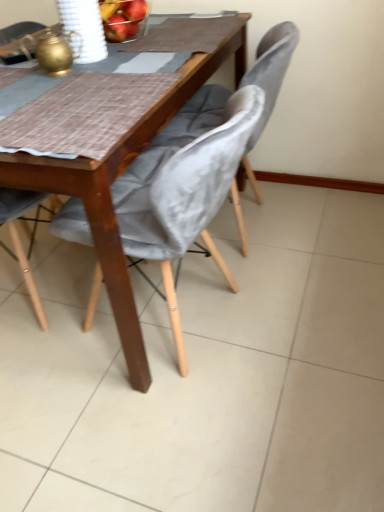
You are a GUI agent. You are given a task and a screenshot of the screen. Output one action in this format:
    pyautogui.click(x=<x>, y=<y>)
    Task: Click on the velvet grey chair at center, which is the second chair in right-to-left order
    The image size is (384, 512).
    Given the screenshot: What is the action you would take?
    pyautogui.click(x=184, y=191)

Locate an element on the screen. This screenshot has height=512, width=384. velvet grey chair at center, the third chair from the left is located at coordinates (269, 79).

Is velvet grey chair at center, the 1th chair in the right-to-left sequence, spatially inside velvet grey chair at lower left, the 3th chair positioned from the right, or outside of it?

velvet grey chair at center, the 1th chair in the right-to-left sequence, cannot be found inside velvet grey chair at lower left, the 3th chair positioned from the right.

Is the depth of velvet grey chair at center, the third chair from the left, greater than that of velvet grey chair at lower left, the 3th chair positioned from the right?

Yes, it is behind velvet grey chair at lower left, the 3th chair positioned from the right.

In terms of height, does velvet grey chair at center, the 1th chair in the right-to-left sequence, look taller or shorter compared to velvet grey chair at lower left, which is the 1th chair from left to right?

Clearly, velvet grey chair at center, the 1th chair in the right-to-left sequence, is shorter compared to velvet grey chair at lower left, which is the 1th chair from left to right.

Looking at their sizes, would you say velvet grey chair at center, which is the second chair in right-to-left order, is wider or thinner than velvet grey chair at lower left, the 3th chair positioned from the right?

velvet grey chair at center, which is the second chair in right-to-left order, is wider than velvet grey chair at lower left, the 3th chair positioned from the right.

From the image's perspective, is velvet grey chair at center, which is the second chair in right-to-left order, located above velvet grey chair at lower left, the 3th chair positioned from the right?

No.

From a real-world perspective, starting from the velvet grey chair at lower left, which is the 1th chair from left to right, which chair is the 2nd one below it? Please provide its 2D coordinates.

[(184, 191)]

In terms of height, does velvet grey chair at center, the third chair from the left, look taller or shorter compared to velvet grey chair at center, which is the second chair in right-to-left order?

In the image, velvet grey chair at center, the third chair from the left, appears to be taller than velvet grey chair at center, which is the second chair in right-to-left order.

The height and width of the screenshot is (512, 384). Identify the location of chair below the velvet grey chair at center, the 1th chair in the right-to-left sequence (from a real-world perspective). (184, 191).

Does velvet grey chair at center, the third chair from the left, touch velvet grey chair at center, which is the second chair in right-to-left order?

There is a gap between velvet grey chair at center, the third chair from the left, and velvet grey chair at center, which is the second chair in right-to-left order.

From a real-world perspective, relative to velvet grey chair at center, the second chair positioned from the left, is velvet grey chair at lower left, the 3th chair positioned from the right, vertically above or below?

velvet grey chair at lower left, the 3th chair positioned from the right, is above velvet grey chair at center, the second chair positioned from the left.

Can you tell me how much velvet grey chair at lower left, the 3th chair positioned from the right, and velvet grey chair at center, the second chair positioned from the left, differ in facing direction?

The angular difference between velvet grey chair at lower left, the 3th chair positioned from the right, and velvet grey chair at center, the second chair positioned from the left, is 180 degrees.

Looking at their sizes, would you say velvet grey chair at lower left, the 3th chair positioned from the right, is wider or thinner than velvet grey chair at center, which is the second chair in right-to-left order?

Clearly, velvet grey chair at lower left, the 3th chair positioned from the right, has less width compared to velvet grey chair at center, which is the second chair in right-to-left order.

Is point (196, 189) positioned behind point (281, 80)?

No, it is in front of (281, 80).

Starting from the velvet grey chair at center, the third chair from the left, which chair is the 2nd one in front? Please provide its 2D coordinates.

[(184, 191)]

Considering the relative sizes of velvet grey chair at lower left, which is the 1th chair from left to right, and velvet grey chair at center, the 1th chair in the right-to-left sequence, in the image provided, is velvet grey chair at lower left, which is the 1th chair from left to right, smaller than velvet grey chair at center, the 1th chair in the right-to-left sequence,?

No, velvet grey chair at lower left, which is the 1th chair from left to right, is not smaller than velvet grey chair at center, the 1th chair in the right-to-left sequence.

From a real-world perspective, is velvet grey chair at lower left, which is the 1th chair from left to right, located higher than velvet grey chair at center, the third chair from the left?

Yes, from a real-world perspective, velvet grey chair at lower left, which is the 1th chair from left to right, is over velvet grey chair at center, the third chair from the left

Would you say velvet grey chair at lower left, which is the 1th chair from left to right, is outside velvet grey chair at center, the 1th chair in the right-to-left sequence?

Yes, velvet grey chair at lower left, which is the 1th chair from left to right, is located beyond the bounds of velvet grey chair at center, the 1th chair in the right-to-left sequence.

Where is `chair behind the velvet grey chair at lower left, the 3th chair positioned from the right`? This screenshot has width=384, height=512. chair behind the velvet grey chair at lower left, the 3th chair positioned from the right is located at coordinates (269, 79).

Where is `chair in front of the velvet grey chair at lower left, the 3th chair positioned from the right`? The height and width of the screenshot is (512, 384). chair in front of the velvet grey chair at lower left, the 3th chair positioned from the right is located at coordinates (184, 191).

Considering their positions, is velvet grey chair at center, the 1th chair in the right-to-left sequence, positioned closer to velvet grey chair at lower left, which is the 1th chair from left to right, than velvet grey chair at center, which is the second chair in right-to-left order?

Based on the image, velvet grey chair at center, which is the second chair in right-to-left order, appears to be nearer to velvet grey chair at lower left, which is the 1th chair from left to right.

Looking at the image, which one is located further to velvet grey chair at center, the third chair from the left, velvet grey chair at center, the second chair positioned from the left, or velvet grey chair at lower left, which is the 1th chair from left to right?

Based on the image, velvet grey chair at lower left, which is the 1th chair from left to right, appears to be further to velvet grey chair at center, the third chair from the left.

From the image, which object appears to be farther from velvet grey chair at center, the 1th chair in the right-to-left sequence, velvet grey chair at lower left, which is the 1th chair from left to right, or velvet grey chair at center, which is the second chair in right-to-left order?

velvet grey chair at lower left, which is the 1th chair from left to right.

From the image, which object appears to be nearer to velvet grey chair at lower left, the 3th chair positioned from the right, velvet grey chair at center, the second chair positioned from the left, or velvet grey chair at center, the 1th chair in the right-to-left sequence?

velvet grey chair at center, the second chair positioned from the left, lies closer to velvet grey chair at lower left, the 3th chair positioned from the right, than the other object.

Which object lies nearer to the anchor point velvet grey chair at center, which is the second chair in right-to-left order, velvet grey chair at center, the third chair from the left, or velvet grey chair at lower left, which is the 1th chair from left to right?

velvet grey chair at center, the third chair from the left, is positioned closer to the anchor velvet grey chair at center, which is the second chair in right-to-left order.

Considering their positions, is velvet grey chair at lower left, which is the 1th chair from left to right, positioned further to velvet grey chair at center, the second chair positioned from the left, than velvet grey chair at center, the third chair from the left?

velvet grey chair at lower left, which is the 1th chair from left to right, lies further to velvet grey chair at center, the second chair positioned from the left, than the other object.

Identify the location of chair between velvet grey chair at lower left, the 3th chair positioned from the right, and velvet grey chair at center, the 1th chair in the right-to-left sequence, in the horizontal direction. (184, 191).